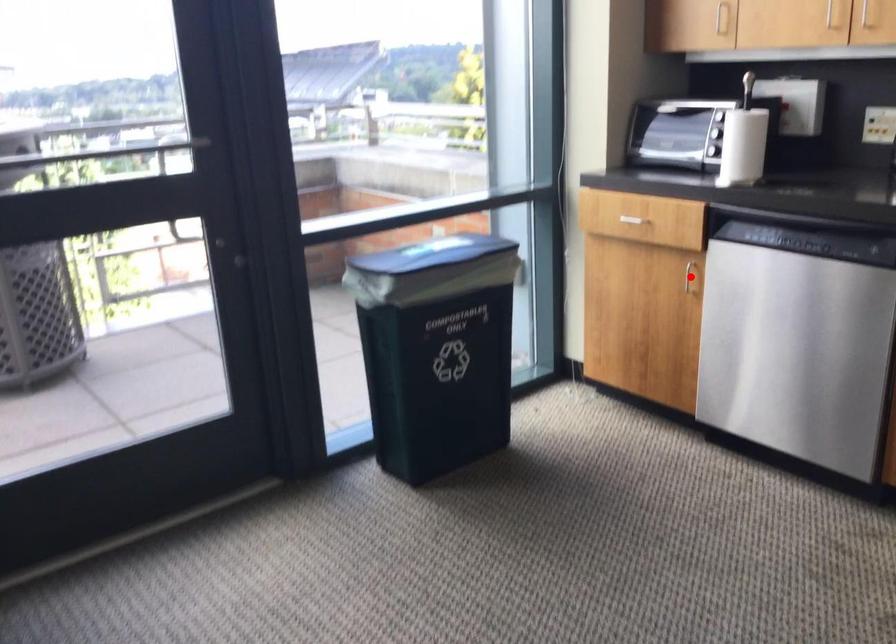
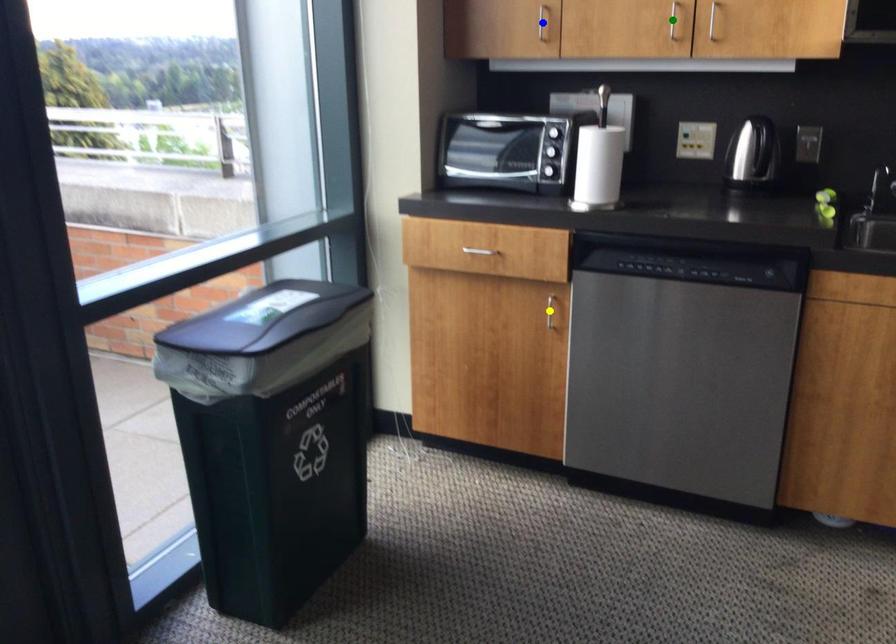
Question: I am providing you with two images of the same scene from different viewpoints. A red point is marked on the first image. You are given multiple points on the second image. Which spot in image 2 lines up with the point in image 1?

Choices:
 (A) green point
 (B) blue point
 (C) yellow point

Answer: (C)